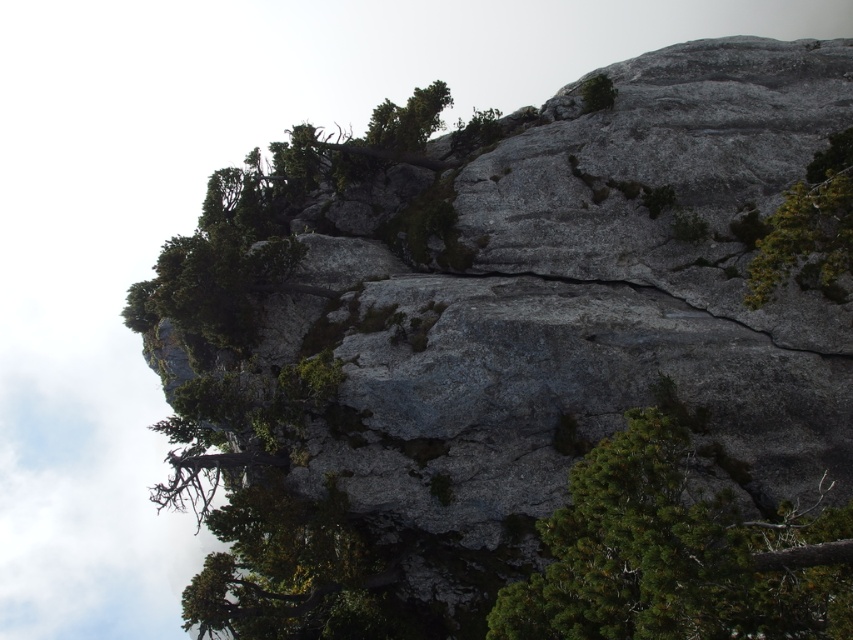
Does green leafy tree at upper right have a greater width compared to green leafy tree at upper center?

Correct, the width of green leafy tree at upper right exceeds that of green leafy tree at upper center.

The height and width of the screenshot is (640, 853). What do you see at coordinates (808, 225) in the screenshot?
I see `green leafy tree at upper right` at bounding box center [808, 225].

Which is in front, point (805, 205) or point (599, 104)?

Point (805, 205) is more forward.

Find the location of a particular element. Image resolution: width=853 pixels, height=640 pixels. green leafy tree at upper right is located at coordinates (808, 225).

Describe the element at coordinates (676, 556) in the screenshot. I see `green needle-like at center` at that location.

Is the position of green needle-like at center less distant than that of green leafy tree at upper center?

Yes, green needle-like at center is closer to the viewer.

Who is more distant from viewer, (601, 499) or (601, 84)?

The point (601, 84) is more distant.

This screenshot has height=640, width=853. What are the coordinates of `green needle-like at center` in the screenshot? It's located at (676, 556).

Who is taller, green needle-like at center or green leafy tree at upper right?

Standing taller between the two is green leafy tree at upper right.

Does point (656, 458) lie behind point (828, 173)?

That is False.

The width and height of the screenshot is (853, 640). I want to click on green needle-like at center, so click(x=676, y=556).